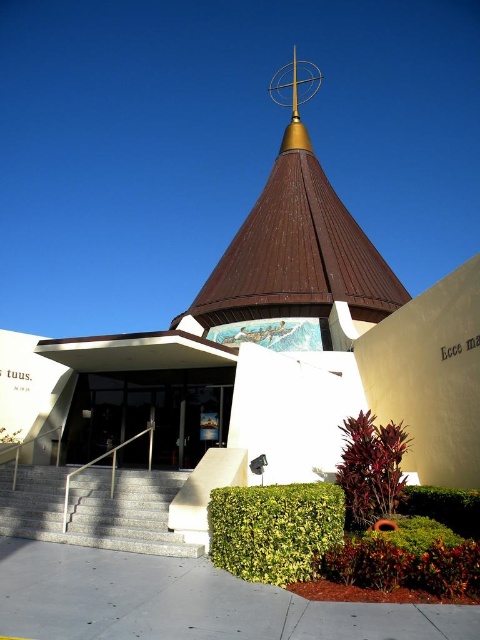
Which is below, granite stairs at lower left or green leafy hedge at lower right?

Positioned lower is granite stairs at lower left.

Who is positioned more to the left, granite stairs at lower left or green leafy hedge at lower right?

From the viewer's perspective, granite stairs at lower left appears more on the left side.

Between point (21, 502) and point (398, 508), which one is positioned in front?

Point (398, 508) is in front.

Identify the location of granite stairs at lower left. (94, 508).

What do you see at coordinates (371, 468) in the screenshot?
I see `dark red leafy plant at lower center` at bounding box center [371, 468].

Is dark red leafy plant at lower center to the right of green leafy hedge at lower right from the viewer's perspective?

No, dark red leafy plant at lower center is not to the right of green leafy hedge at lower right.

Is point (394, 490) farther from camera compared to point (424, 500)?

No.

Where is `dark red leafy plant at lower center`? dark red leafy plant at lower center is located at coordinates (371, 468).

Can you confirm if granite stairs at lower left is bigger than dark red leafy plant at lower center?

Actually, granite stairs at lower left might be smaller than dark red leafy plant at lower center.

Which is in front, point (97, 477) or point (342, 481)?

Point (342, 481) is in front.

I want to click on granite stairs at lower left, so click(94, 508).

I want to click on granite stairs at lower left, so click(x=94, y=508).